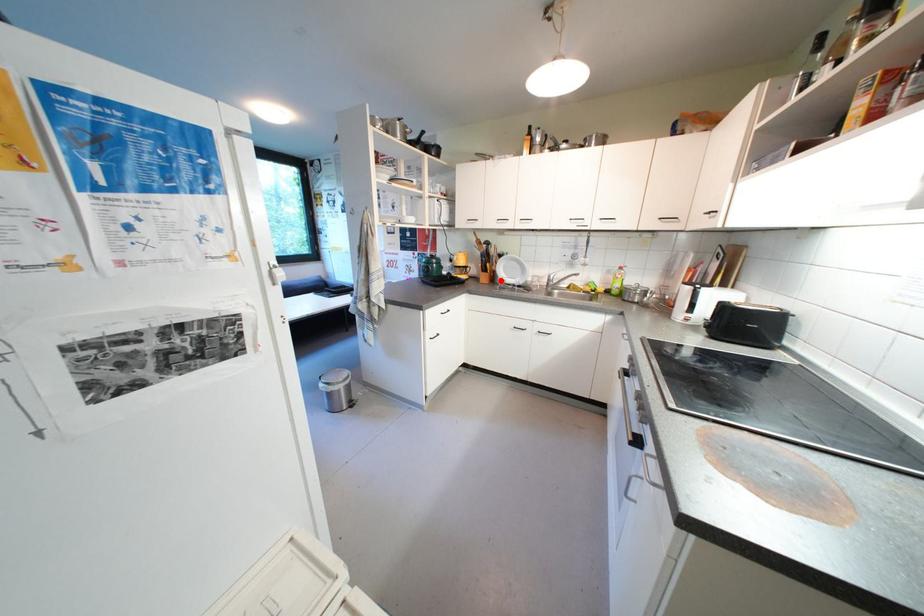
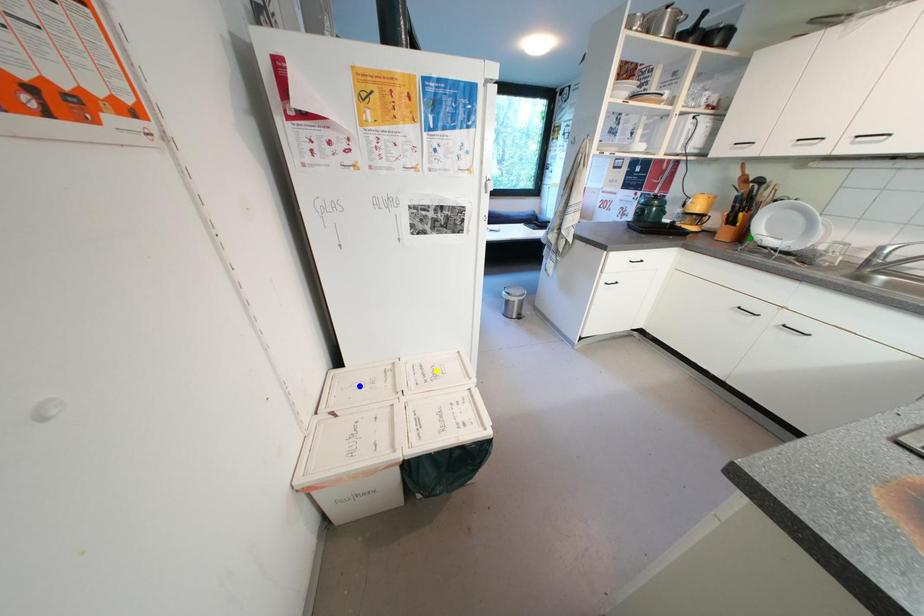
Question: I am providing you with two images of the same scene from different viewpoints. A red point is marked on the first image. You are given multiple points on the second image. Which point in image 2 represents the same 3d spot as the red point in image 1?

Choices:
 (A) blue point
 (B) yellow point
 (C) green point

Answer: (C)